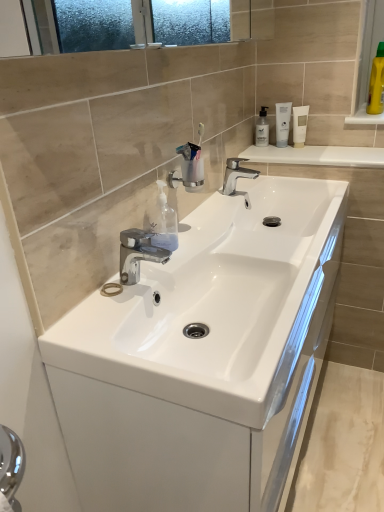
The image size is (384, 512). Identify the location of vacant region to the left of chrome metallic faucet at center, the 2th tap viewed from the right. (96, 300).